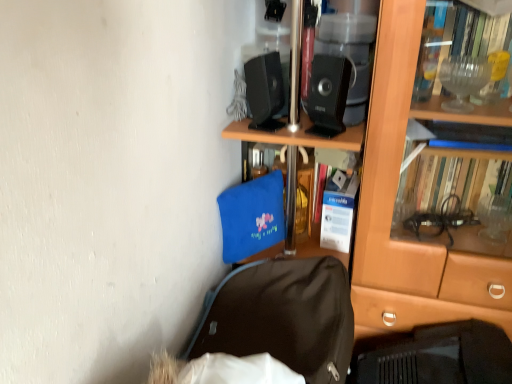
Question: Relative to black fabric backpack at lower center, is black plastic speaker at upper center, which is counted as the 1th loudspeaker, starting from the right, in front or behind?

Choices:
 (A) behind
 (B) front

Answer: (A)

Question: Visually, is black plastic speaker at upper center, marked as the 2th loudspeaker in a left-to-right arrangement, positioned to the left or to the right of black fabric backpack at lower center?

Choices:
 (A) right
 (B) left

Answer: (A)

Question: Which object is the closest to the black matte laptop at lower right?

Choices:
 (A) black fabric backpack at lower center
 (B) black plastic speaker at upper center, which is counted as the 1th loudspeaker, starting from the right
 (C) black plastic speaker at upper center, positioned as the 2th loudspeaker in right-to-left order
 (D) brown wooden bookcase at center
 (E) blue fabric bag at center

Answer: (D)

Question: Considering the real-world distances, which object is closest to the brown wooden bookcase at center?

Choices:
 (A) blue fabric bag at center
 (B) black plastic speaker at upper center, which ranks as the 1th loudspeaker in left-to-right order
 (C) black matte laptop at lower right
 (D) black fabric backpack at lower center
 (E) black plastic speaker at upper center, marked as the 2th loudspeaker in a left-to-right arrangement

Answer: (C)